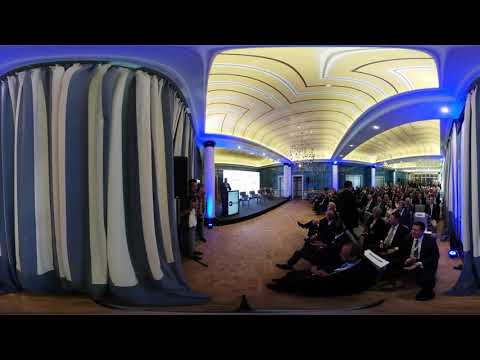
You are a GUI agent. You are given a task and a screenshot of the screen. Output one action in this format:
    pyautogui.click(x=<x>, y=<y>)
    Task: Click on the yellow ceiling
    The height and width of the screenshot is (360, 480).
    Given the screenshot: What is the action you would take?
    pyautogui.click(x=302, y=109)